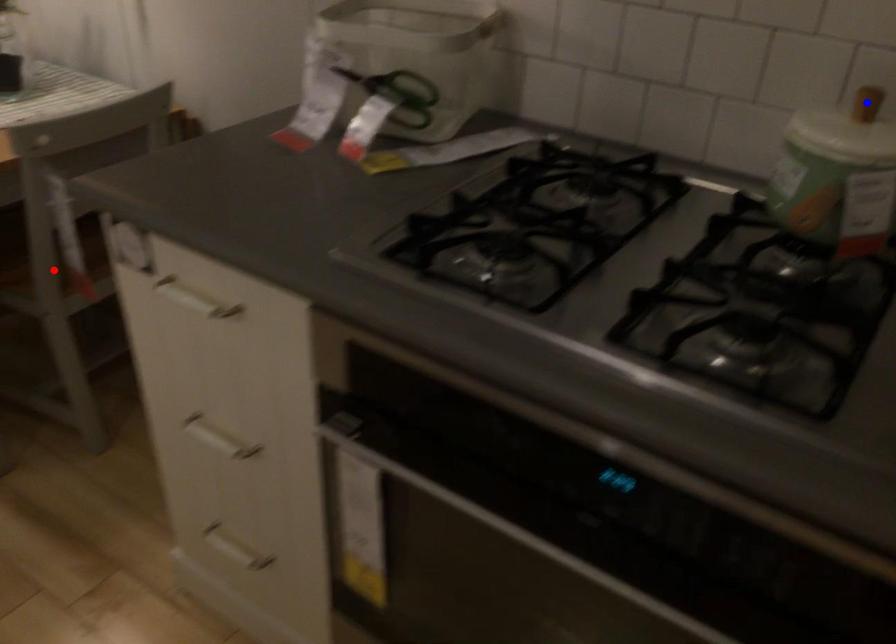
Question: Which of the two points in the image is closer to the camera?

Choices:
 (A) Blue point is closer.
 (B) Red point is closer.

Answer: (A)